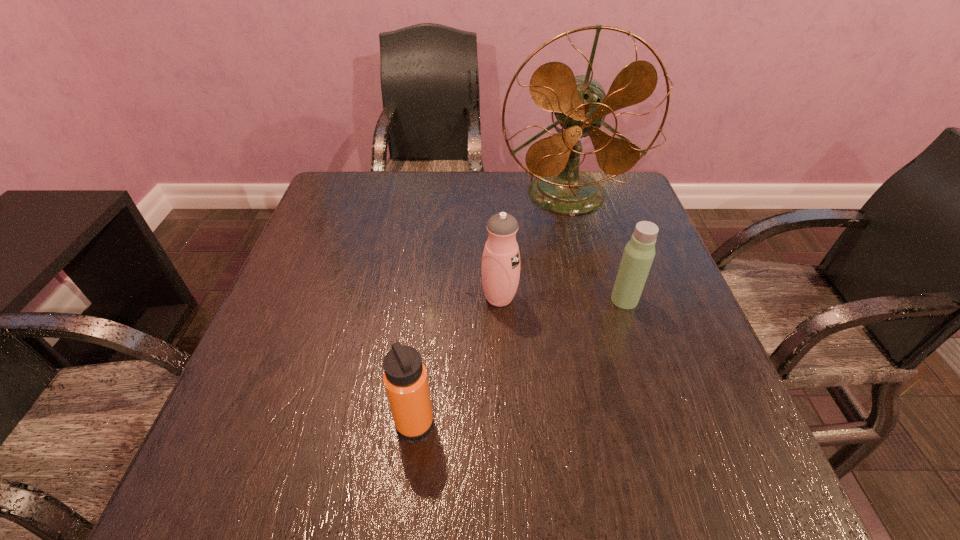
Locate an element on the screen. object that is at the far edge is located at coordinates (580, 104).

You are a GUI agent. You are given a task and a screenshot of the screen. Output one action in this format:
    pyautogui.click(x=<x>, y=<y>)
    Task: Click on the fan located in the right edge section of the desktop
    This screenshot has height=540, width=960.
    Given the screenshot: What is the action you would take?
    tap(580, 104)

Find the location of a particular element. This screenshot has height=540, width=960. thermos bottle positioned at the right edge is located at coordinates (639, 252).

Where is `object located in the far right corner section of the desktop`? This screenshot has height=540, width=960. object located in the far right corner section of the desktop is located at coordinates (580, 104).

Where is `vacant area at the far edge of the desktop`? The image size is (960, 540). vacant area at the far edge of the desktop is located at coordinates (529, 213).

In the image, there is a desktop. Identify the location of vacant space at the right edge. This screenshot has height=540, width=960. (611, 226).

You are a GUI agent. You are given a task and a screenshot of the screen. Output one action in this format:
    pyautogui.click(x=<x>, y=<y>)
    Task: Click on the blank space at the far left corner
    The image size is (960, 540).
    Given the screenshot: What is the action you would take?
    pyautogui.click(x=343, y=206)

The width and height of the screenshot is (960, 540). What are the coordinates of `vacant space at the far right corner of the desktop` in the screenshot? It's located at (613, 220).

Locate an element on the screen. This screenshot has height=540, width=960. vacant space in between the nearest object and the second thermos bottle from left to right is located at coordinates (457, 360).

The height and width of the screenshot is (540, 960). In order to click on free space between the fan and the second thermos bottle from right to left in this screenshot , I will do `click(533, 247)`.